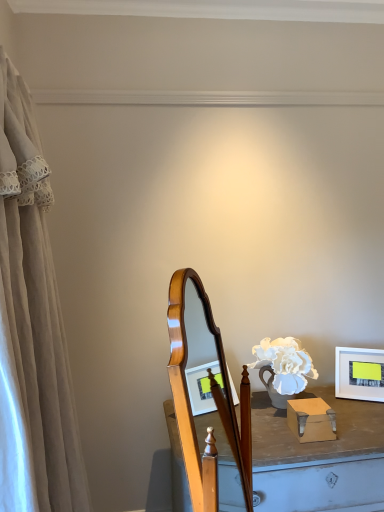
Where is `white matte picture frame at right`? white matte picture frame at right is located at coordinates (359, 373).

In order to face white matte picture frame at right, should I rotate leftwards or rightwards?

Turn right approximately 21.708 degrees to face it.

Image resolution: width=384 pixels, height=512 pixels. Describe the element at coordinates (359, 373) in the screenshot. I see `white matte picture frame at right` at that location.

The image size is (384, 512). What are the coordinates of `beige fabric curtain at left` in the screenshot? It's located at (32, 327).

Describe the element at coordinates (32, 327) in the screenshot. I see `beige fabric curtain at left` at that location.

I want to click on white matte picture frame at right, so pyautogui.click(x=359, y=373).

Considering the positions of objects white matte picture frame at right and beige fabric curtain at left in the image provided, who is more to the left, white matte picture frame at right or beige fabric curtain at left?

beige fabric curtain at left.

Is the depth of white matte picture frame at right greater than that of beige fabric curtain at left?

Yes, the depth of white matte picture frame at right is greater than that of beige fabric curtain at left.

Is point (382, 353) positioned behind point (48, 464)?

Yes, it is.

From the image's perspective, does white matte picture frame at right appear higher than beige fabric curtain at left?

No, from the image's perspective, white matte picture frame at right is not above beige fabric curtain at left.

From a real-world perspective, is white matte picture frame at right above or below beige fabric curtain at left?

white matte picture frame at right is situated lower than beige fabric curtain at left in the real world.

Which object is wider, white matte picture frame at right or beige fabric curtain at left?

beige fabric curtain at left is wider.

From their relative heights in the image, would you say white matte picture frame at right is taller or shorter than beige fabric curtain at left?

In the image, white matte picture frame at right appears to be shorter than beige fabric curtain at left.

Which of these two, white matte picture frame at right or beige fabric curtain at left, is bigger?

With larger size is beige fabric curtain at left.

Is white matte picture frame at right positioned beyond the bounds of beige fabric curtain at left?

Yes.

Would you say white matte picture frame at right is a long distance from beige fabric curtain at left?

white matte picture frame at right is far away from beige fabric curtain at left.

Is white matte picture frame at right aimed at beige fabric curtain at left?

No.

Can you tell me how much white matte picture frame at right and beige fabric curtain at left differ in facing direction?

The angle between the facing direction of white matte picture frame at right and the facing direction of beige fabric curtain at left is 27 degrees.

The width and height of the screenshot is (384, 512). Identify the location of curtain above the white matte picture frame at right (from the image's perspective). (32, 327).

Visually, is beige fabric curtain at left positioned to the left or to the right of white matte picture frame at right?

From the image, it's evident that beige fabric curtain at left is to the left of white matte picture frame at right.

Is beige fabric curtain at left in front of or behind white matte picture frame at right in the image?

beige fabric curtain at left is in front of white matte picture frame at right.

Between point (28, 336) and point (351, 387), which one is positioned behind?

The point (351, 387) is more distant.

From the image's perspective, between beige fabric curtain at left and white matte picture frame at right, who is located below?

white matte picture frame at right, from the image's perspective.

From a real-world perspective, does beige fabric curtain at left sit lower than white matte picture frame at right?

Incorrect, from a real-world perspective, beige fabric curtain at left is higher than white matte picture frame at right.

Considering the relative sizes of beige fabric curtain at left and white matte picture frame at right in the image provided, is beige fabric curtain at left wider than white matte picture frame at right?

Correct, the width of beige fabric curtain at left exceeds that of white matte picture frame at right.

Considering the relative sizes of beige fabric curtain at left and white matte picture frame at right in the image provided, is beige fabric curtain at left taller than white matte picture frame at right?

Yes, beige fabric curtain at left is taller than white matte picture frame at right.

Which of these two, beige fabric curtain at left or white matte picture frame at right, is bigger?

Bigger between the two is beige fabric curtain at left.

Would you say beige fabric curtain at left contains white matte picture frame at right?

No, white matte picture frame at right is not inside beige fabric curtain at left.

Is the surface of beige fabric curtain at left in direct contact with white matte picture frame at right?

No, beige fabric curtain at left is not with white matte picture frame at right.

Is beige fabric curtain at left oriented towards white matte picture frame at right?

No, beige fabric curtain at left is not aimed at white matte picture frame at right.

Identify the location of picture frame located behind the beige fabric curtain at left. This screenshot has width=384, height=512. (359, 373).

You are a GUI agent. You are given a task and a screenshot of the screen. Output one action in this format:
    pyautogui.click(x=<x>, y=<y>)
    Task: Click on the curtain located in front of the white matte picture frame at right
    This screenshot has height=512, width=384.
    Given the screenshot: What is the action you would take?
    pyautogui.click(x=32, y=327)

At what (x,y) coordinates should I click in order to perform the action: click on curtain on the left of white matte picture frame at right. Please return your answer as a coordinate pair (x, y). This screenshot has width=384, height=512. Looking at the image, I should click on (32, 327).